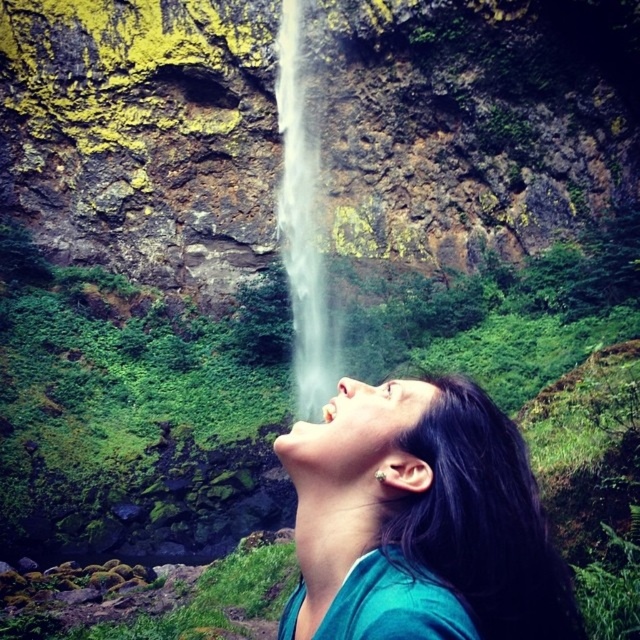
Question: Among these points, which one is farthest from the camera?

Choices:
 (A) (525, 608)
 (B) (305, 269)

Answer: (B)

Question: Is teal fabric shirt at center in front of white misty waterfall at center?

Choices:
 (A) yes
 (B) no

Answer: (A)

Question: Which point is farther to the camera?

Choices:
 (A) (314, 84)
 (B) (324, 493)

Answer: (A)

Question: Is teal fabric shirt at center smaller than white misty waterfall at center?

Choices:
 (A) yes
 (B) no

Answer: (A)

Question: Is teal fabric shirt at center closer to camera compared to white misty waterfall at center?

Choices:
 (A) yes
 (B) no

Answer: (A)